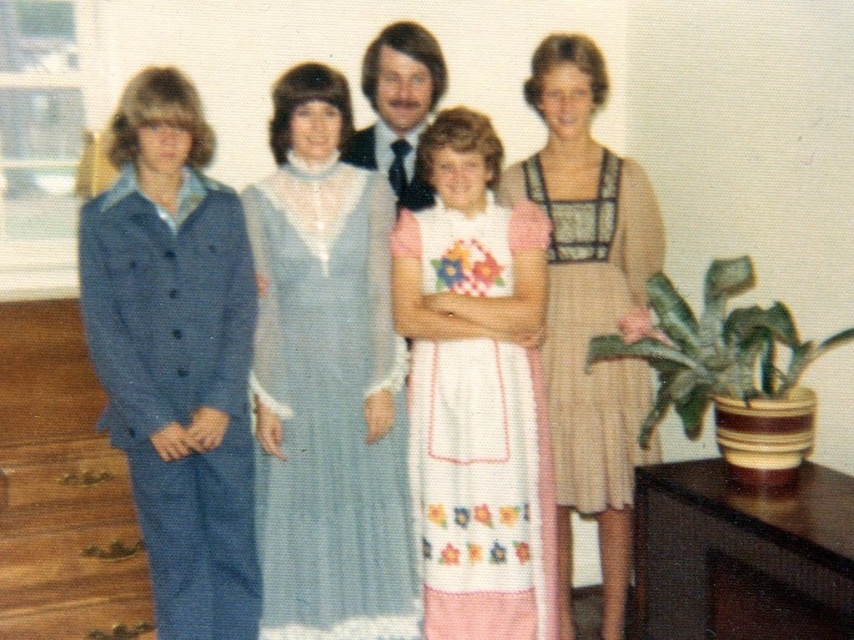
You are a photographer adjusting the lighting for a family photo. You notice the light blue sheer fabric dress at center and the smooth brown hair at center. Which object requires more space in the frame to properly capture its details?

The light blue sheer fabric dress at center requires more space in the frame because it is bigger than the smooth brown hair at center.

Based on the scene description, which object is positioned lower between the light blue sheer fabric dress at center and the smooth brown hair at center?

The light blue sheer fabric dress at center is located below smooth brown hair at center, so the light blue sheer fabric dress at center is positioned lower.

You are a photographer setting up for a family portrait in a living room. You notice the beige textured dress at center and the smooth brown hair at center. Which object is positioned lower in the image?

The beige textured dress at center is located below smooth brown hair at center, so the beige textured dress at center is positioned lower in the image.